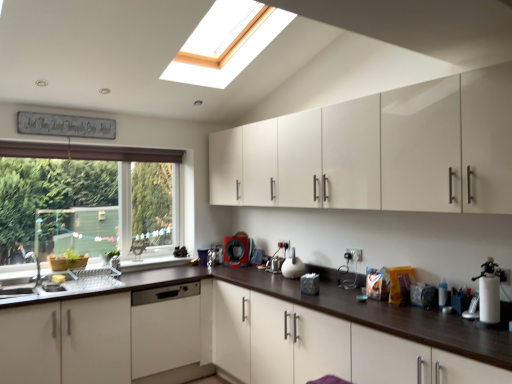
What is the approximate height of glossy white cabinets at upper center, the 1th cabinetry viewed from the top?

glossy white cabinets at upper center, the 1th cabinetry viewed from the top, is 29.05 inches tall.

The image size is (512, 384). What are the coordinates of `white glossy cabinets at center, the second cabinetry in the top-to-bottom sequence` in the screenshot? It's located at (326, 347).

This screenshot has width=512, height=384. Identify the location of black plastic coffee machine at center. (236, 251).

The height and width of the screenshot is (384, 512). Describe the element at coordinates (236, 251) in the screenshot. I see `black plastic coffee machine at center` at that location.

The height and width of the screenshot is (384, 512). Find the location of `green matte window at left`. green matte window at left is located at coordinates (89, 152).

Which of these two, white glossy sink at lower left or glossy white cabinets at upper center, placed as the 2th cabinetry when sorted from bottom to top, is wider?

Wider between the two is white glossy sink at lower left.

Does white glossy sink at lower left come behind glossy white cabinets at upper center, placed as the 2th cabinetry when sorted from bottom to top?

Yes, white glossy sink at lower left is further from the camera.

The width and height of the screenshot is (512, 384). Identify the location of sink below the glossy white cabinets at upper center, the 1th cabinetry viewed from the top (from a real-world perspective). (33, 288).

Can you tell me how much white matte dishwasher at center and green matte window at left differ in facing direction?

The angle between the facing direction of white matte dishwasher at center and the facing direction of green matte window at left is 1.04 degrees.

Is white matte dishwasher at center to the right of green matte window at left from the viewer's perspective?

Indeed, white matte dishwasher at center is positioned on the right side of green matte window at left.

How much distance is there between white matte dishwasher at center and green matte window at left?

They are 5.15 feet apart.

Is white matte dishwasher at center touching green matte window at left?

white matte dishwasher at center and green matte window at left are not in contact.

In the scene shown: Does green matte window at left have a larger size compared to white glossy cabinets at center, the second cabinetry in the top-to-bottom sequence?

Incorrect, green matte window at left is not larger than white glossy cabinets at center, the second cabinetry in the top-to-bottom sequence.

Can you confirm if green matte window at left is thinner than white glossy cabinets at center, positioned as the first cabinetry in bottom-to-top order?

Yes, green matte window at left is thinner than white glossy cabinets at center, positioned as the first cabinetry in bottom-to-top order.

In the scene shown: Is the surface of green matte window at left in direct contact with white glossy cabinets at center, positioned as the first cabinetry in bottom-to-top order?

No, green matte window at left is not in contact with white glossy cabinets at center, positioned as the first cabinetry in bottom-to-top order.

Considering the positions of objects green matte window at left and white glossy cabinets at center, positioned as the first cabinetry in bottom-to-top order, in the image provided, who is more to the left, green matte window at left or white glossy cabinets at center, positioned as the first cabinetry in bottom-to-top order,?

Positioned to the left is green matte window at left.

How different are the orientations of black plastic coffee machine at center and white matte dishwasher at center in degrees?

53.6 degrees separate the facing orientations of black plastic coffee machine at center and white matte dishwasher at center.

How distant is black plastic coffee machine at center from white matte dishwasher at center?

A distance of 31.73 inches exists between black plastic coffee machine at center and white matte dishwasher at center.

Could you tell me if black plastic coffee machine at center is turned towards white matte dishwasher at center?

No, black plastic coffee machine at center is not turned towards white matte dishwasher at center.

Between black plastic coffee machine at center and white matte dishwasher at center, which one has more height?

white matte dishwasher at center.

Can you tell me how much white glossy sink at lower left and white glossy cabinets at center, positioned as the first cabinetry in bottom-to-top order, differ in facing direction?

The angle between the facing direction of white glossy sink at lower left and the facing direction of white glossy cabinets at center, positioned as the first cabinetry in bottom-to-top order, is 90.5 degrees.

In the scene shown: From a real-world perspective, between white glossy sink at lower left and white glossy cabinets at center, positioned as the first cabinetry in bottom-to-top order, who is vertically lower?

white glossy cabinets at center, positioned as the first cabinetry in bottom-to-top order.

Who is taller, white glossy sink at lower left or white glossy cabinets at center, the second cabinetry in the top-to-bottom sequence?

white glossy cabinets at center, the second cabinetry in the top-to-bottom sequence.

Looking at the image, does white glossy sink at lower left seem bigger or smaller compared to white glossy cabinets at center, the second cabinetry in the top-to-bottom sequence?

Clearly, white glossy sink at lower left is smaller in size than white glossy cabinets at center, the second cabinetry in the top-to-bottom sequence.

Considering their positions, is white matte dishwasher at center located in front of or behind white glossy sink at lower left?

Clearly, white matte dishwasher at center is behind white glossy sink at lower left.

Which is more to the right, white matte dishwasher at center or white glossy sink at lower left?

Positioned to the right is white matte dishwasher at center.

From a real-world perspective, is white matte dishwasher at center beneath white glossy sink at lower left?

Yes, from a real-world perspective, white matte dishwasher at center is under white glossy sink at lower left.

Where is `sink that is above the white matte dishwasher at center (from the image's perspective)`? sink that is above the white matte dishwasher at center (from the image's perspective) is located at coordinates (33, 288).

Considering the positions of objects green matte window at left and black plastic coffee machine at center in the image provided, who is more to the left, green matte window at left or black plastic coffee machine at center?

green matte window at left.

The image size is (512, 384). In order to click on window above the black plastic coffee machine at center (from the image's perspective) in this screenshot , I will do `click(89, 152)`.

Is green matte window at left wider than black plastic coffee machine at center?

No.

From a real-world perspective, which object stands above the other?

From a 3D spatial view, green matte window at left is above.

There is a white glossy sink at lower left. Where is `cabinetry above it (from a real-world perspective)`? The image size is (512, 384). cabinetry above it (from a real-world perspective) is located at coordinates (379, 151).

At what (x,y) coordinates should I click in order to perform the action: click on window behind the white matte dishwasher at center. Please return your answer as a coordinate pair (x, y). Looking at the image, I should click on (89, 152).

Based on their spatial positions, is white glossy sink at lower left or white matte dishwasher at center further from glossy white cabinets at upper center, the 1th cabinetry viewed from the top?

Among the two, white glossy sink at lower left is located further to glossy white cabinets at upper center, the 1th cabinetry viewed from the top.

Considering their positions, is white glossy cabinets at center, positioned as the first cabinetry in bottom-to-top order, positioned closer to glossy white cabinets at upper center, the 1th cabinetry viewed from the top, than white glossy sink at lower left?

white glossy cabinets at center, positioned as the first cabinetry in bottom-to-top order, is closer to glossy white cabinets at upper center, the 1th cabinetry viewed from the top.

Estimate the real-world distances between objects in this image. Which object is closer to white glossy sink at lower left, white glossy cabinets at center, the second cabinetry in the top-to-bottom sequence, or black plastic coffee machine at center?

black plastic coffee machine at center is closer to white glossy sink at lower left.

Based on their spatial positions, is white glossy sink at lower left or white glossy cabinets at center, positioned as the first cabinetry in bottom-to-top order, further from black plastic coffee machine at center?

The object further to black plastic coffee machine at center is white glossy sink at lower left.

Based on their spatial positions, is white glossy cabinets at center, the second cabinetry in the top-to-bottom sequence, or green matte window at left closer to white matte dishwasher at center?

Answer: The object closer to white matte dishwasher at center is white glossy cabinets at center, the second cabinetry in the top-to-bottom sequence.

Which object lies further to the anchor point white glossy sink at lower left, white glossy cabinets at center, the second cabinetry in the top-to-bottom sequence, or white matte dishwasher at center?

Based on the image, white glossy cabinets at center, the second cabinetry in the top-to-bottom sequence, appears to be further to white glossy sink at lower left.

Consider the image. Looking at the image, which one is located closer to black plastic coffee machine at center, glossy white cabinets at upper center, placed as the 2th cabinetry when sorted from bottom to top, or green matte window at left?

green matte window at left.

Considering their positions, is black plastic coffee machine at center positioned closer to white matte dishwasher at center than white glossy cabinets at center, positioned as the first cabinetry in bottom-to-top order?

white glossy cabinets at center, positioned as the first cabinetry in bottom-to-top order.

At what (x,y) coordinates should I click in order to perform the action: click on home appliance between white glossy sink at lower left and white glossy cabinets at center, positioned as the first cabinetry in bottom-to-top order, from left to right. Please return your answer as a coordinate pair (x, y). The width and height of the screenshot is (512, 384). Looking at the image, I should click on (165, 328).

Locate an element on the screen. The image size is (512, 384). coffee machine between white glossy sink at lower left and glossy white cabinets at upper center, placed as the 2th cabinetry when sorted from bottom to top is located at coordinates pos(236,251).

Where is `home appliance between white glossy sink at lower left and black plastic coffee machine at center in the horizontal direction`? This screenshot has height=384, width=512. home appliance between white glossy sink at lower left and black plastic coffee machine at center in the horizontal direction is located at coordinates (165, 328).

Locate an element on the screen. The width and height of the screenshot is (512, 384). cabinetry positioned between white glossy cabinets at center, the second cabinetry in the top-to-bottom sequence, and black plastic coffee machine at center from near to far is located at coordinates (379, 151).